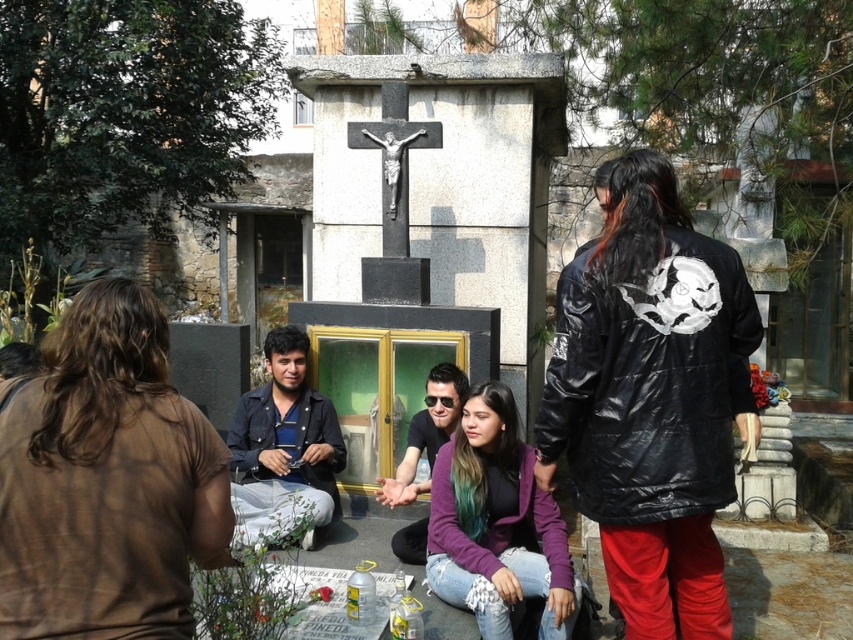
Question: Which of these objects is positioned closest to the shiny black jacket at center?

Choices:
 (A) black matte sunglasses at center
 (B) denim jacket at center

Answer: (A)

Question: Can you confirm if shiny black jacket at center is thinner than denim jacket at center?

Choices:
 (A) yes
 (B) no

Answer: (B)

Question: Considering the real-world distances, which object is farthest from the shiny black jacket at center?

Choices:
 (A) black matte sunglasses at center
 (B) denim jacket at center

Answer: (B)

Question: Can you confirm if shiny black jacket at center is positioned to the right of black matte sunglasses at center?

Choices:
 (A) yes
 (B) no

Answer: (A)

Question: Does denim jacket at center appear under black matte sunglasses at center?

Choices:
 (A) yes
 (B) no

Answer: (A)

Question: Among these objects, which one is farthest from the camera?

Choices:
 (A) shiny black jacket at center
 (B) black matte sunglasses at center
 (C) denim jacket at center

Answer: (B)